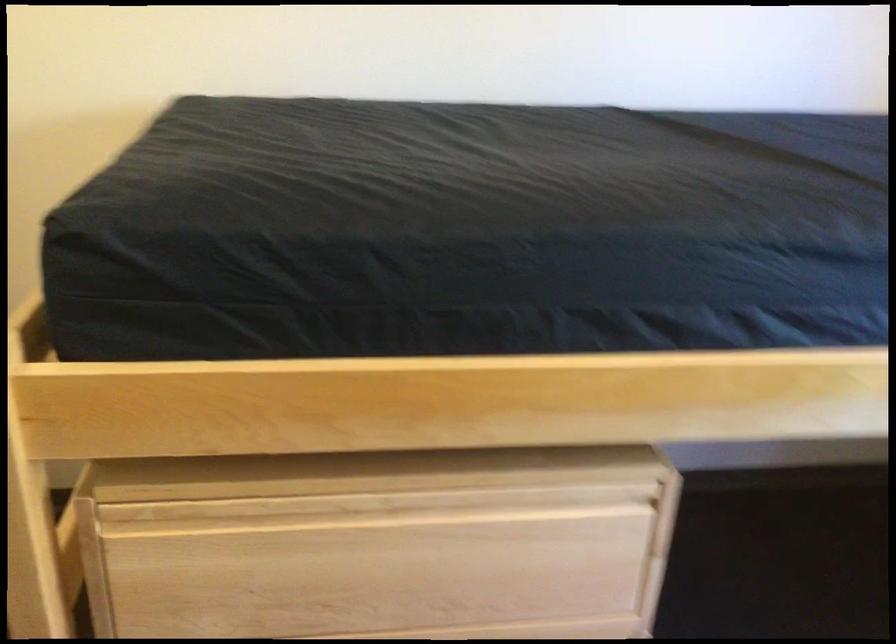
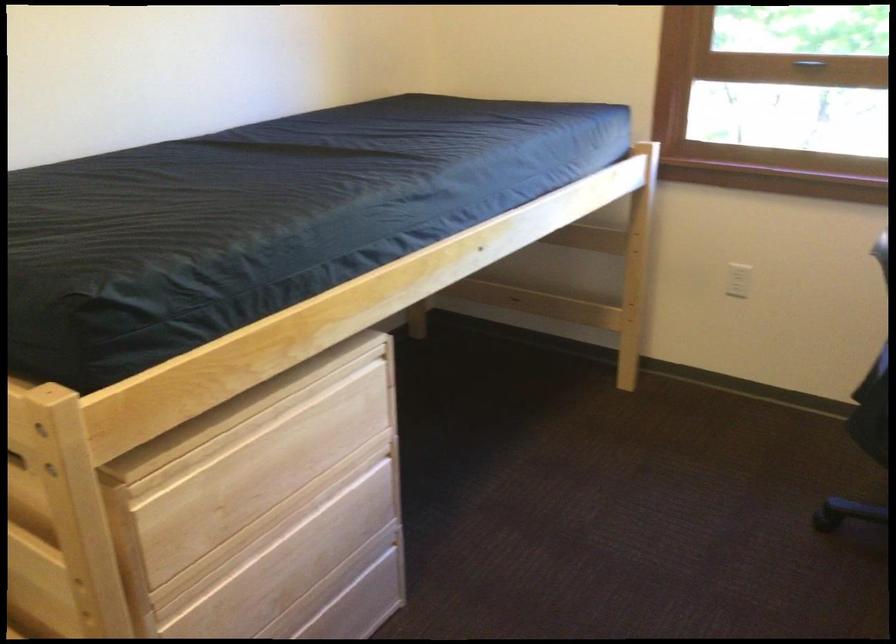
The point at (401, 554) is marked in the first image. Where is the corresponding point in the second image?

(285, 448)